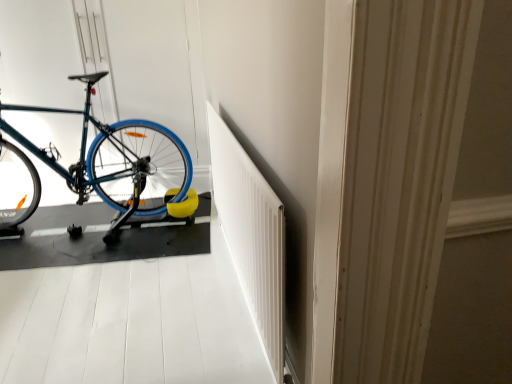
Question: From the image's perspective, is blue rubber bike at left located beneath teal matte bicycle at left?

Choices:
 (A) yes
 (B) no

Answer: (A)

Question: Is blue rubber bike at left facing towards teal matte bicycle at left?

Choices:
 (A) yes
 (B) no

Answer: (B)

Question: Can you confirm if blue rubber bike at left is thinner than teal matte bicycle at left?

Choices:
 (A) yes
 (B) no

Answer: (B)

Question: Is blue rubber bike at left to the left of teal matte bicycle at left from the viewer's perspective?

Choices:
 (A) no
 (B) yes

Answer: (A)

Question: Is blue rubber bike at left shorter than teal matte bicycle at left?

Choices:
 (A) yes
 (B) no

Answer: (A)

Question: Is point coord(239,365) closer or farther from the camera than point coord(214,187)?

Choices:
 (A) farther
 (B) closer

Answer: (B)

Question: Is blue rubber bike at left taller or shorter than white textured radiator at center?

Choices:
 (A) tall
 (B) short

Answer: (B)

Question: Visually, is blue rubber bike at left positioned to the left or to the right of white textured radiator at center?

Choices:
 (A) left
 (B) right

Answer: (A)

Question: Is blue rubber bike at left in front of or behind white textured radiator at center in the image?

Choices:
 (A) front
 (B) behind

Answer: (B)

Question: Considering the relative positions of white textured radiator at center and teal matte bicycle at left in the image provided, is white textured radiator at center to the left or to the right of teal matte bicycle at left?

Choices:
 (A) left
 (B) right

Answer: (B)

Question: From a real-world perspective, is white textured radiator at center positioned above or below teal matte bicycle at left?

Choices:
 (A) below
 (B) above

Answer: (A)

Question: In terms of size, does white textured radiator at center appear bigger or smaller than teal matte bicycle at left?

Choices:
 (A) big
 (B) small

Answer: (B)

Question: In the image, is white textured radiator at center positioned in front of or behind teal matte bicycle at left?

Choices:
 (A) behind
 (B) front

Answer: (B)

Question: From the image's perspective, relative to teal matte bicycle at left, is blue rubber bike at left above or below?

Choices:
 (A) above
 (B) below

Answer: (B)

Question: Is blue rubber bike at left inside or outside of teal matte bicycle at left?

Choices:
 (A) inside
 (B) outside

Answer: (B)